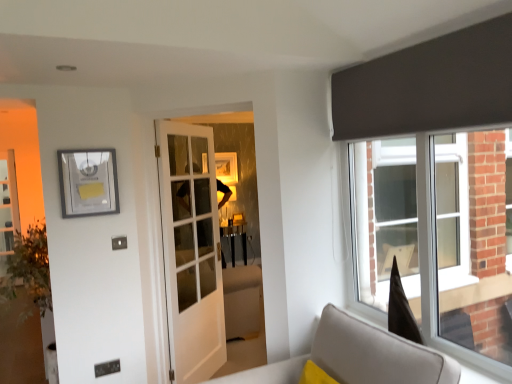
What is the approximate width of matte silver picture frame at upper left?

It is 1.64 inches.

In order to click on matte silver picture frame at upper left in this screenshot , I will do `click(88, 182)`.

This screenshot has height=384, width=512. I want to click on light gray fabric sofa at lower right, so click(357, 357).

In the scene shown: From the image's perspective, is light gray fabric sofa at lower right below white glass door at center?

Yes, from the image's perspective, light gray fabric sofa at lower right is beneath white glass door at center.

Considering the sizes of light gray fabric sofa at lower right and white glass door at center in the image, is light gray fabric sofa at lower right wider or thinner than white glass door at center?

In the image, light gray fabric sofa at lower right appears to be wider than white glass door at center.

Is light gray fabric sofa at lower right beside white glass door at center?

There is a gap between light gray fabric sofa at lower right and white glass door at center.

In the scene shown: Which is in front, light gray fabric sofa at lower right or white glass door at center?

Positioned in front is light gray fabric sofa at lower right.

Is white glass door at center in front of or behind light gray fabric sofa at lower right in the image?

Clearly, white glass door at center is behind light gray fabric sofa at lower right.

Identify the location of furniture below the white glass door at center (from a real-world perspective). (357, 357).

Considering the relative sizes of white glass door at center and light gray fabric sofa at lower right in the image provided, is white glass door at center smaller than light gray fabric sofa at lower right?

Yes.

From the image's perspective, is white glass door at center located above or below light gray fabric sofa at lower right?

Based on their image positions, white glass door at center is located above light gray fabric sofa at lower right.

Which object is closer to the camera, light gray fabric sofa at lower right or matte silver picture frame at upper left?

Positioned in front is light gray fabric sofa at lower right.

Is light gray fabric sofa at lower right oriented away from matte silver picture frame at upper left?

That's not correct — light gray fabric sofa at lower right is not looking away from matte silver picture frame at upper left.

Is point (387, 363) closer to camera compared to point (113, 180)?

Yes.

How different are the orientations of light gray fabric sofa at lower right and matte silver picture frame at upper left in degrees?

90.3 degrees separate the facing orientations of light gray fabric sofa at lower right and matte silver picture frame at upper left.

Between point (91, 204) and point (164, 135), which one is positioned in front?

Point (91, 204)

From a real-world perspective, is matte silver picture frame at upper left over white glass door at center?

Correct, in the physical world, matte silver picture frame at upper left is higher than white glass door at center.

Between matte silver picture frame at upper left and white glass door at center, which one appears on the left side from the viewer's perspective?

matte silver picture frame at upper left.

Measure the distance between white glass door at center and matte silver picture frame at upper left.

They are 27.31 inches apart.

Can you tell me how much white glass door at center and matte silver picture frame at upper left differ in facing direction?

There is a 133-degree angle between the facing directions of white glass door at center and matte silver picture frame at upper left.

From the image's perspective, is white glass door at center located beneath matte silver picture frame at upper left?

Yes.

Can we say white glass door at center lies outside matte silver picture frame at upper left?

Yes, white glass door at center is not within matte silver picture frame at upper left.

Who is taller, matte silver picture frame at upper left or light gray fabric sofa at lower right?

Standing taller between the two is light gray fabric sofa at lower right.

From the image's perspective, which is above, matte silver picture frame at upper left or light gray fabric sofa at lower right?

matte silver picture frame at upper left.

Considering the positions of point (80, 168) and point (377, 330), is point (80, 168) closer or farther from the camera than point (377, 330)?

Point (80, 168) is positioned farther from the camera compared to point (377, 330).

Find the location of a particular element. This screenshot has width=512, height=384. furniture on the right of white glass door at center is located at coordinates (357, 357).

The image size is (512, 384). I want to click on door on the left of light gray fabric sofa at lower right, so click(x=191, y=250).

Looking at the image, which one is located closer to light gray fabric sofa at lower right, matte silver picture frame at upper left or white glass door at center?

Among the two, white glass door at center is located nearer to light gray fabric sofa at lower right.

When comparing their distances from light gray fabric sofa at lower right, does white glass door at center or matte silver picture frame at upper left seem closer?

Among the two, white glass door at center is located nearer to light gray fabric sofa at lower right.

In the scene shown: Which object lies further to the anchor point white glass door at center, light gray fabric sofa at lower right or matte silver picture frame at upper left?

light gray fabric sofa at lower right.

Considering their positions, is white glass door at center positioned closer to matte silver picture frame at upper left than light gray fabric sofa at lower right?

Among the two, white glass door at center is located nearer to matte silver picture frame at upper left.

Estimate the real-world distances between objects in this image. Which object is closer to white glass door at center, matte silver picture frame at upper left or light gray fabric sofa at lower right?

Based on the image, matte silver picture frame at upper left appears to be nearer to white glass door at center.

In the scene shown: Considering their positions, is light gray fabric sofa at lower right positioned closer to matte silver picture frame at upper left than white glass door at center?

white glass door at center lies closer to matte silver picture frame at upper left than the other object.

In order to click on picture frame between light gray fabric sofa at lower right and white glass door at center from front to back in this screenshot , I will do `click(88, 182)`.